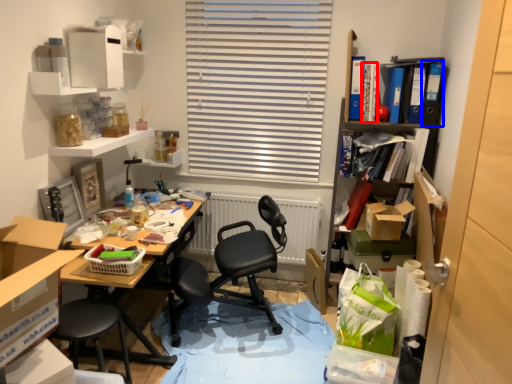
Question: Which of the following is the closest to the observer, book (highlighted by a red box) or book (highlighted by a blue box)?

Choices:
 (A) book
 (B) book

Answer: (B)